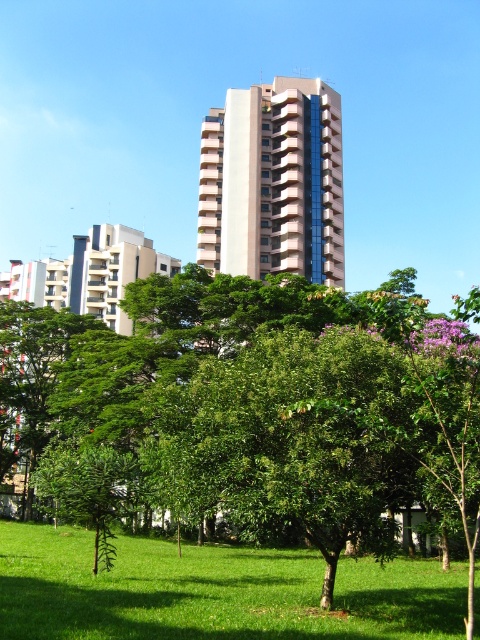
Is point (56, 618) closer to viewer compared to point (205, 172)?

Yes, it is in front of point (205, 172).

Where is `green grass at lower center`? The height and width of the screenshot is (640, 480). green grass at lower center is located at coordinates (214, 592).

Locate an element on the screen. This screenshot has height=640, width=480. green grass at lower center is located at coordinates (214, 592).

Is point (388, 554) positioned in front of point (265, 246)?

Yes, point (388, 554) is closer to viewer.

Between point (313, 545) and point (276, 262), which one is positioned in front?

Positioned in front is point (313, 545).

Identify the location of green leafy tree at center. (251, 419).

Does green leafy tree at center have a lesser height compared to green grass at lower center?

No, green leafy tree at center is not shorter than green grass at lower center.

Does point (34, 312) come behind point (457, 632)?

Yes.

Is point (175, 531) farther from camera compared to point (423, 600)?

Yes, point (175, 531) is farther from viewer.

You are a GUI agent. You are given a task and a screenshot of the screen. Output one action in this format:
    pyautogui.click(x=<x>, y=<y>)
    Task: Click on the green leafy tree at center
    
    Given the screenshot: What is the action you would take?
    pyautogui.click(x=251, y=419)